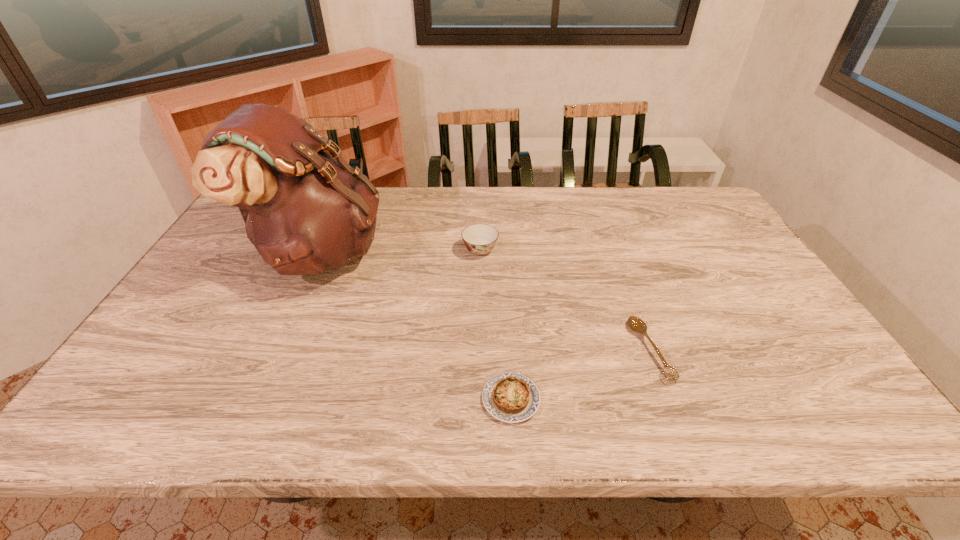
This screenshot has width=960, height=540. What are the coordinates of `satchel` in the screenshot? It's located at (305, 211).

Identify the location of the leftmost object. (305, 211).

Identify the location of the third shortest object. The width and height of the screenshot is (960, 540). (480, 239).

What are the coordinates of `the rightmost object` in the screenshot? It's located at (634, 323).

I want to click on quiche, so click(510, 397).

What are the coordinates of `blank area located 0.370m at the front of the leftmost object with buckles` in the screenshot? It's located at (504, 252).

Image resolution: width=960 pixels, height=540 pixels. Find the location of `free space located on the front of the third shortest object`. free space located on the front of the third shortest object is located at coordinates (480, 338).

Where is `free spot located 0.110m on the left of the ladle`? Image resolution: width=960 pixels, height=540 pixels. free spot located 0.110m on the left of the ladle is located at coordinates (588, 350).

Locate an element on the screen. blank area located 0.100m on the back of the quiche is located at coordinates (508, 342).

You are a GUI agent. You are given a task and a screenshot of the screen. Output one action in this format:
    pyautogui.click(x=<x>, y=<y>)
    Task: Click on the object at the far edge
    The width and height of the screenshot is (960, 540).
    Given the screenshot: What is the action you would take?
    pyautogui.click(x=305, y=211)